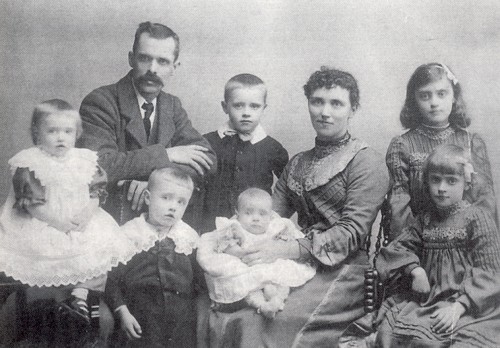
Identify the location of backdrop. (260, 39).